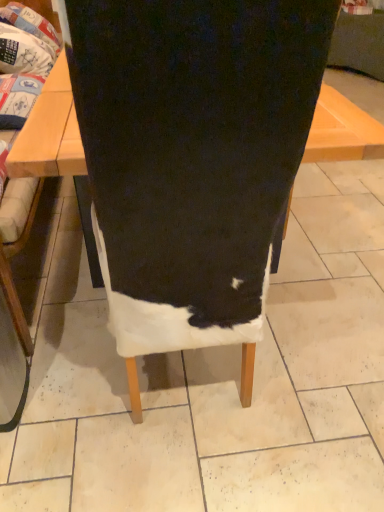
Where is `wooden table at center`? wooden table at center is located at coordinates (50, 133).

What do you see at coordinates (50, 133) in the screenshot? I see `wooden table at center` at bounding box center [50, 133].

Find the location of a particular element. wooden table at center is located at coordinates (50, 133).